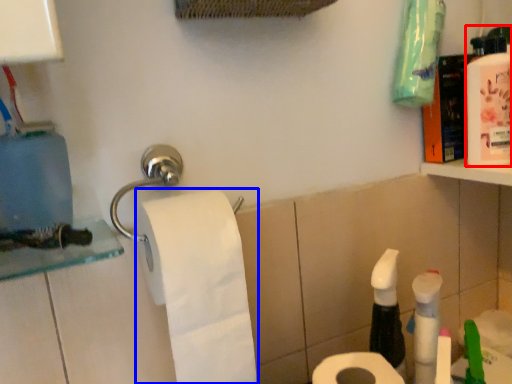
Question: Which of the following is the closest to the observer, mouthwash (highlighted by a red box) or toilet paper (highlighted by a blue box)?

Choices:
 (A) mouthwash
 (B) toilet paper

Answer: (B)